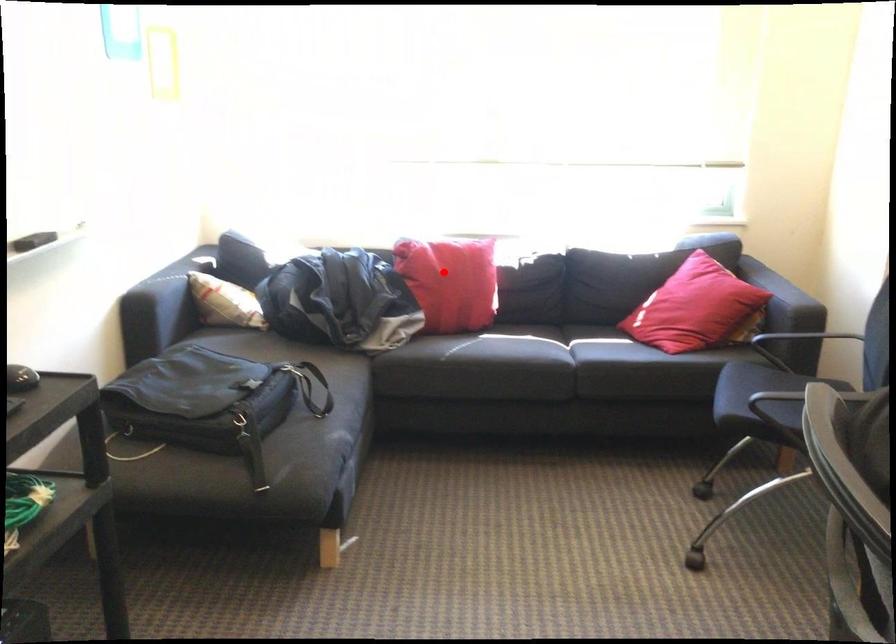
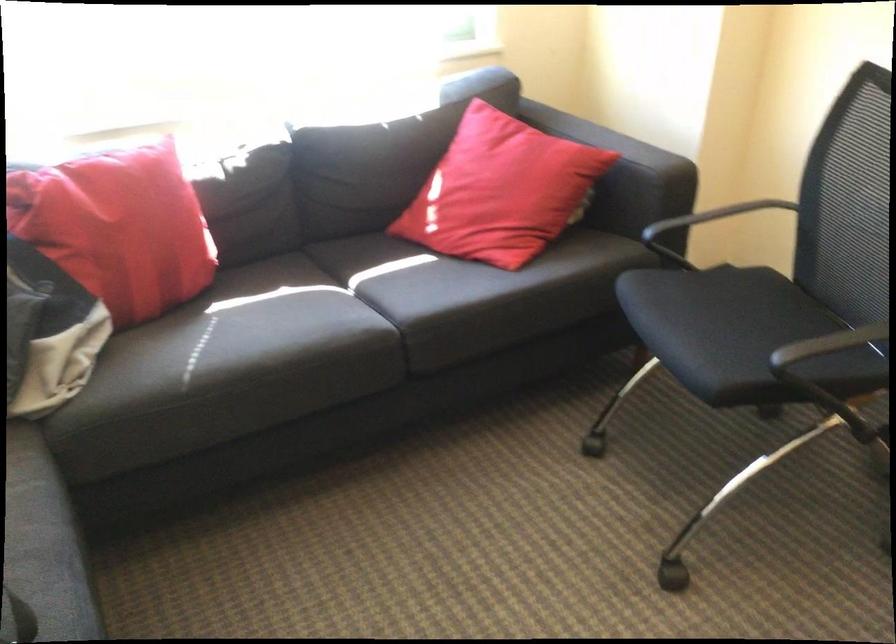
Question: A red point is marked in image1. In image2, is the corresponding 3D point closer to the camera or farther? Reply with the corresponding letter.

Choices:
 (A) The corresponding 3D point is closer.
 (B) The corresponding 3D point is farther.

Answer: (A)